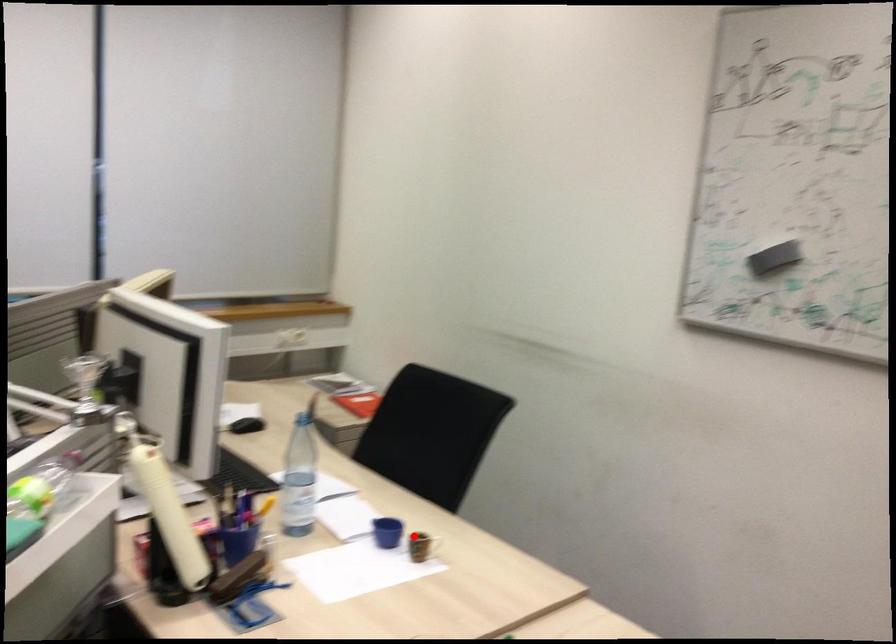
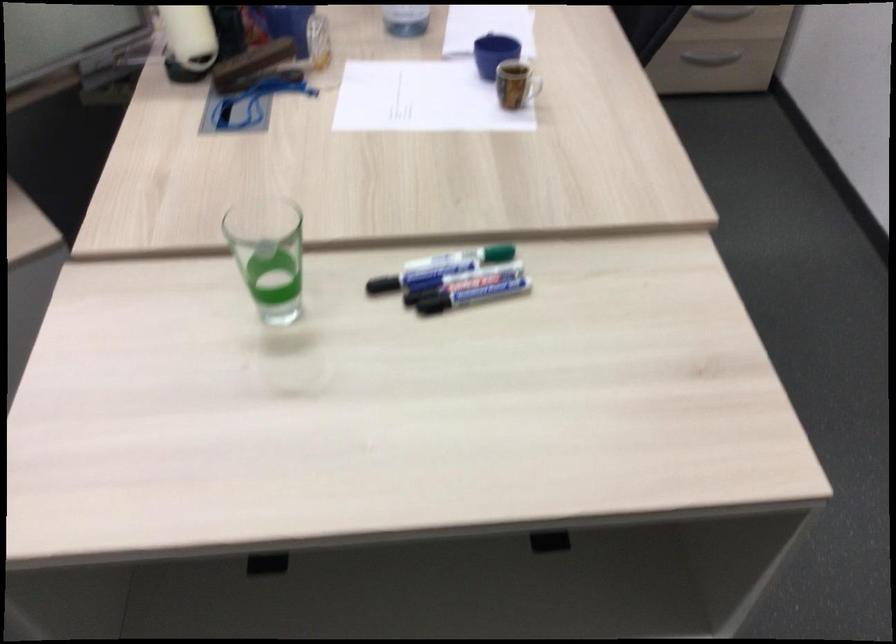
The point at the highlighted location is marked in the first image. Where is the corresponding point in the second image?

(531, 88)